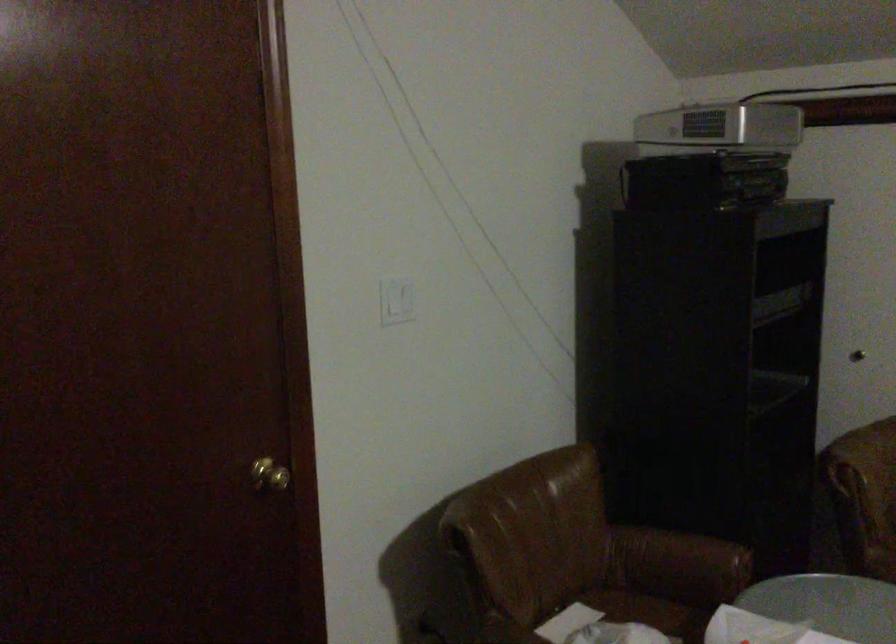
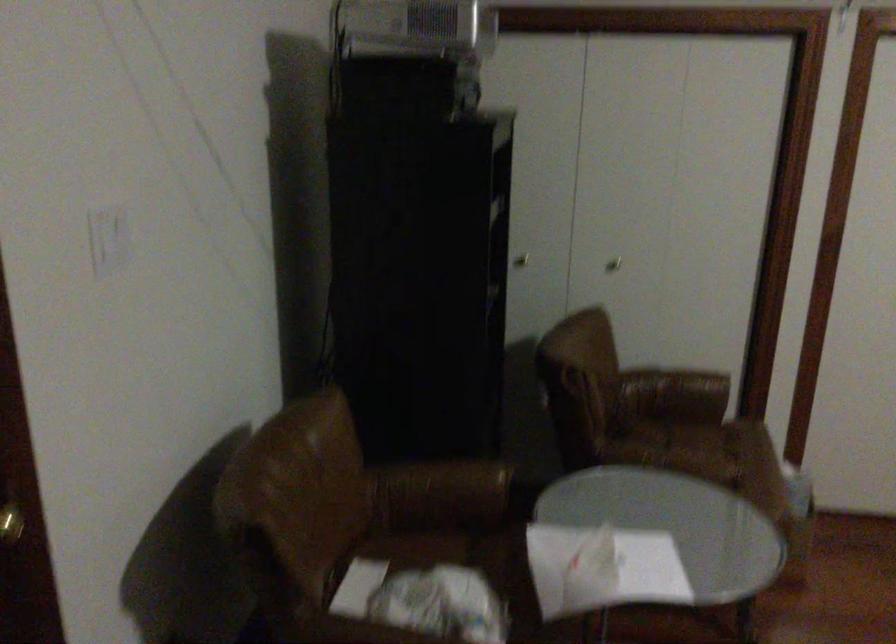
Where in the second image is the point corresponding to pixel 674 558 from the first image?

(442, 488)